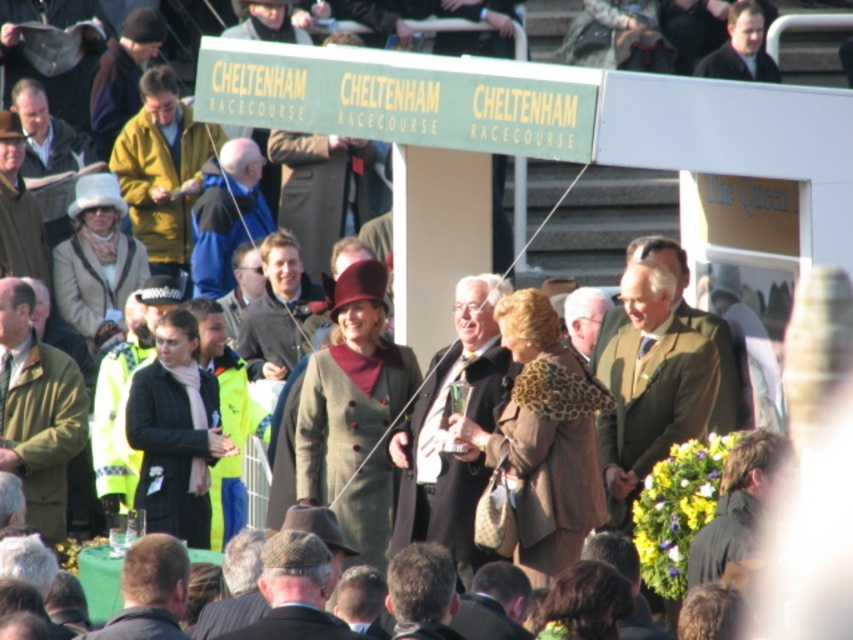
You are attending the Cheltenham Racecourse event and see two people in the crowd. One is wearing a yellow jacket at upper left and another has dark brown hair at lower left. Which person is positioned more to the left side of the scene?

The yellow jacket at upper left is positioned more to the left side of the scene as it is to the left of dark brown hair at lower left.

You are a photographer at the event and want to capture a photo of both the green wool coat at center and the brown tweed hat at lower center. Which object should you focus on first to ensure both are in frame?

The green wool coat at center is taller than the brown tweed hat at lower center. To ensure both are in frame, focus on the taller object first, which is the green wool coat at center, then adjust to include the brown tweed hat at lower center.